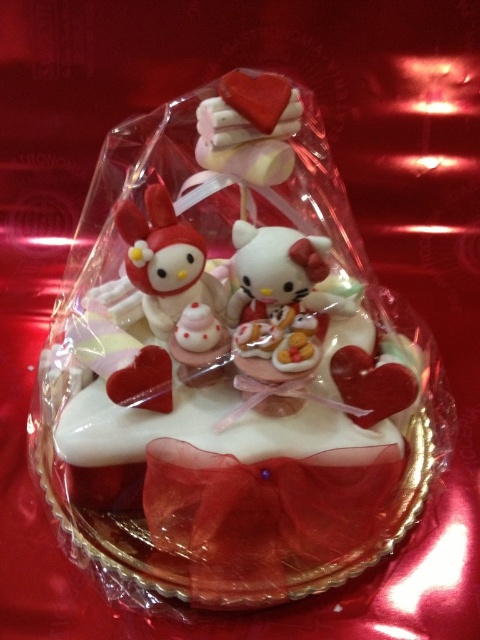
Between point (388, 500) and point (183, 248), which one is positioned behind?

The point (388, 500) is more distant.

Is point (133, 177) closer to viewer compared to point (190, 298)?

That is False.

Is point (127, 125) behind point (187, 264)?

Yes.

Where is `white glossy cake at center`? white glossy cake at center is located at coordinates (228, 364).